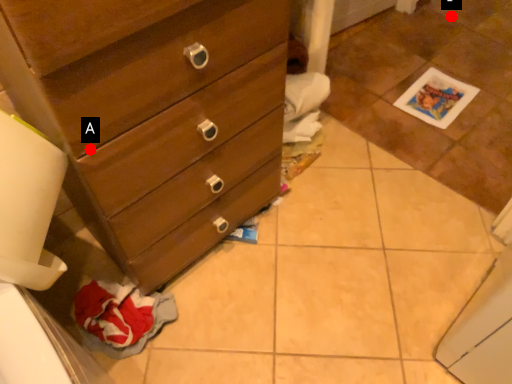
Question: Two points are circled on the image, labeled by A and B beside each circle. Which point appears closest to the camera in this image?

Choices:
 (A) A is closer
 (B) B is closer

Answer: (A)